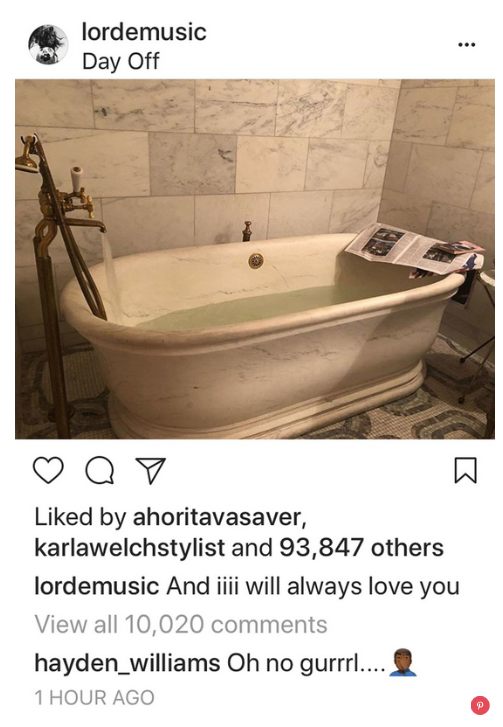
You are a GUI agent. You are given a task and a screenshot of the screen. Output one action in this format:
    pyautogui.click(x=<x>, y=<y>)
    Task: Click on the faucet knobs
    This screenshot has height=727, width=503.
    Given the screenshot: What is the action you would take?
    pyautogui.click(x=89, y=206), pyautogui.click(x=82, y=196)